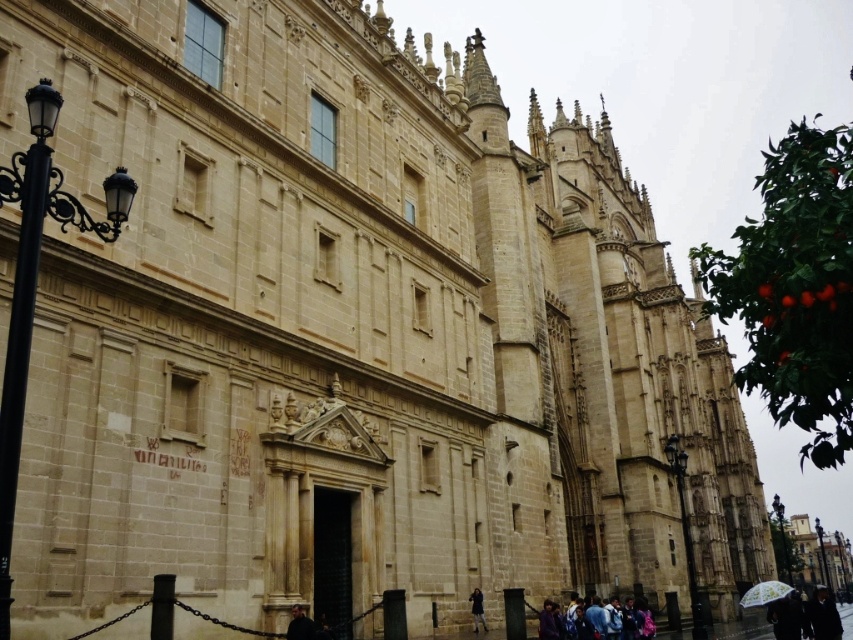
You are a photographer standing at the base of the grand historic building. You want to take a photo of the denim jacket at lower center while also capturing the entire facade of the building in the background. Considering the distance of the denim jacket from the camera, will you need to adjust your position to ensure both the jacket and the building are in frame?

The denim jacket at lower center is 54.67 meters from the camera. Since the jacket is quite far away, you may need to move closer to it to ensure it is visible and in focus while still capturing the building facade in the background.

You are standing in front of the grand historic building and want to take a photo that includes both the green leafy tree with small orange fruits at right and the dark gray stone person at lower center. Based on their widths, which object might require you to adjust your camera angle to fit both into the frame?

The green leafy tree with small orange fruits at right might be wider than the dark gray stone person at lower center, so you might need to adjust your camera angle to ensure both fit into the frame.